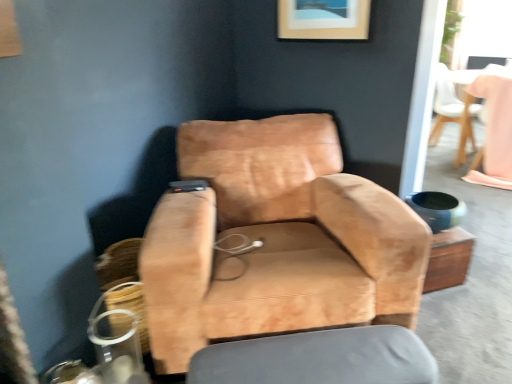
Question: From a real-world perspective, does wooden picture frame at upper center stand above pink fabric table at upper right?

Choices:
 (A) no
 (B) yes

Answer: (B)

Question: Is wooden picture frame at upper center beside pink fabric table at upper right?

Choices:
 (A) no
 (B) yes

Answer: (A)

Question: Is wooden picture frame at upper center facing away from pink fabric table at upper right?

Choices:
 (A) no
 (B) yes

Answer: (A)

Question: Considering the relative positions of wooden picture frame at upper center and pink fabric table at upper right in the image provided, is wooden picture frame at upper center to the right of pink fabric table at upper right from the viewer's perspective?

Choices:
 (A) yes
 (B) no

Answer: (B)

Question: Considering the relative sizes of wooden picture frame at upper center and pink fabric table at upper right in the image provided, is wooden picture frame at upper center shorter than pink fabric table at upper right?

Choices:
 (A) yes
 (B) no

Answer: (A)

Question: From the image's perspective, is suede tan chair at center, which ranks as the 1th chair in bottom-to-top order, above or below pink fabric table at upper right?

Choices:
 (A) below
 (B) above

Answer: (A)

Question: Does point (336, 297) appear closer or farther from the camera than point (497, 91)?

Choices:
 (A) farther
 (B) closer

Answer: (B)

Question: From a real-world perspective, is suede tan chair at center, which ranks as the 1th chair in bottom-to-top order, above or below pink fabric table at upper right?

Choices:
 (A) above
 (B) below

Answer: (A)

Question: Is suede tan chair at center, which appears as the 1th chair when viewed from the left, taller or shorter than pink fabric table at upper right?

Choices:
 (A) tall
 (B) short

Answer: (A)

Question: Considering the positions of light brown leather chair at upper right, acting as the first chair starting from the top, and wooden picture frame at upper center in the image, is light brown leather chair at upper right, acting as the first chair starting from the top, bigger or smaller than wooden picture frame at upper center?

Choices:
 (A) big
 (B) small

Answer: (A)

Question: From the image's perspective, relative to wooden picture frame at upper center, is light brown leather chair at upper right, acting as the first chair starting from the top, above or below?

Choices:
 (A) above
 (B) below

Answer: (B)

Question: Is light brown leather chair at upper right, which is the first chair in back-to-front order, taller or shorter than wooden picture frame at upper center?

Choices:
 (A) tall
 (B) short

Answer: (A)

Question: From a real-world perspective, is light brown leather chair at upper right, marked as the 2th chair in a left-to-right arrangement, positioned above or below wooden picture frame at upper center?

Choices:
 (A) above
 (B) below

Answer: (B)

Question: From the image's perspective, is wooden picture frame at upper center located above or below suede tan chair at center, the 2th chair from the top?

Choices:
 (A) above
 (B) below

Answer: (A)

Question: Is wooden picture frame at upper center in front of or behind suede tan chair at center, the first chair positioned from the front, in the image?

Choices:
 (A) behind
 (B) front

Answer: (A)